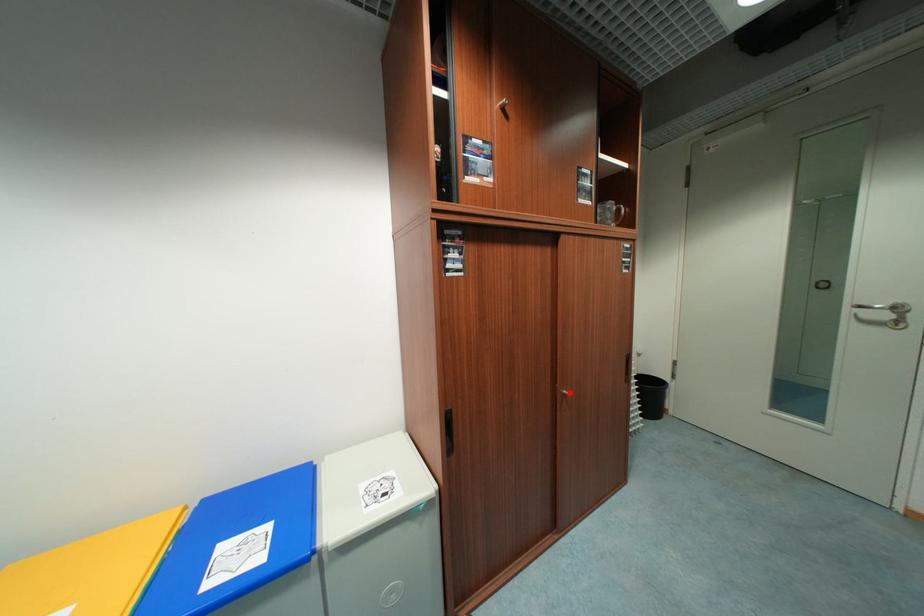
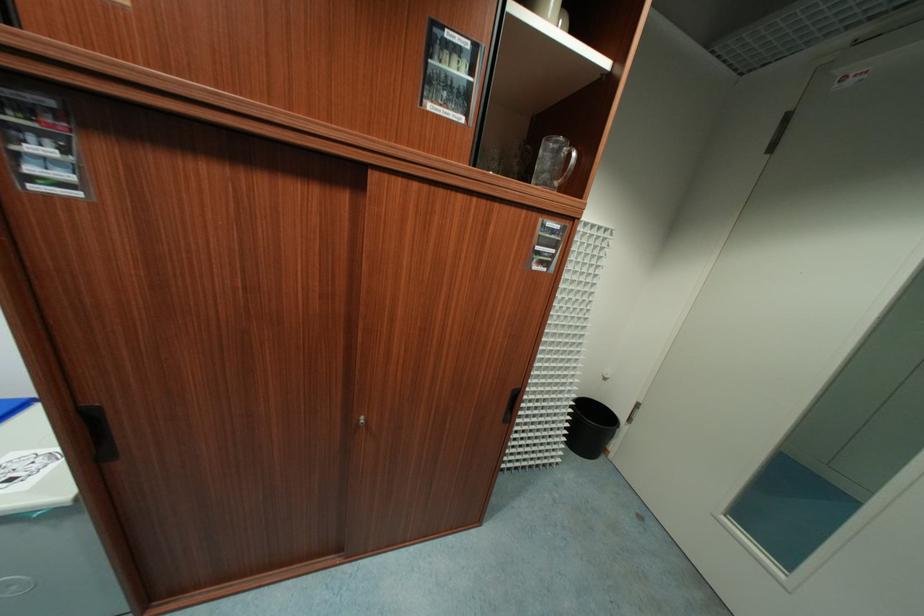
Question: A red point is marked in image1. In image2, is the corresponding 3D point closer to the camera or farther? Reply with the corresponding letter.

Choices:
 (A) The corresponding 3D point is closer.
 (B) The corresponding 3D point is farther.

Answer: (B)